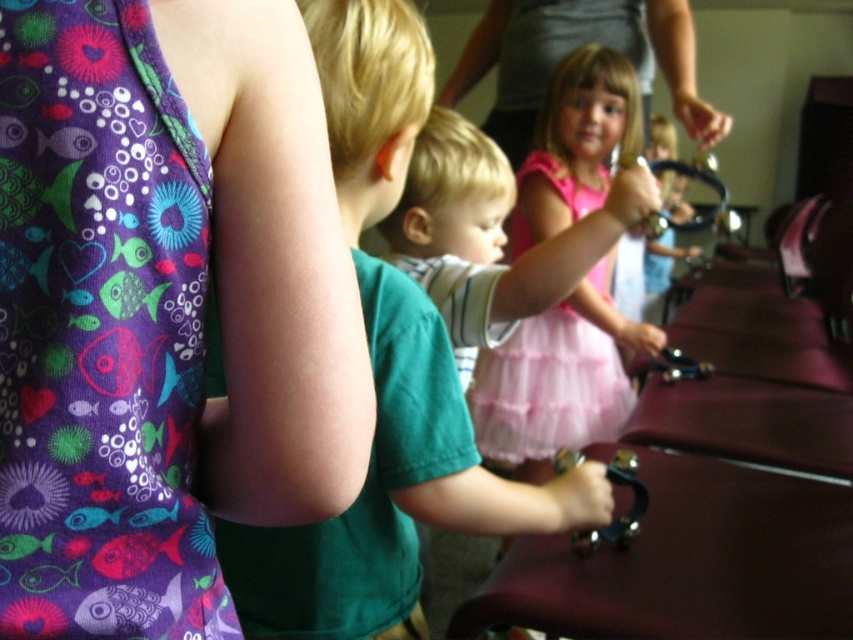
You are a photographer trying to capture a closeup of the child holding the handbell at point (630, 392) while also wanting to include the other child at point (680, 24) in the frame. Which child should you focus on to ensure the subject is sharp and in focus?

You should focus on the child at point (630, 392) because it is closer to the camera and will be in focus, while the other child at point (680, 24) will be slightly out of focus due to the depth of field.

You are a costume designer preparing for a play. You have two options for a character costume. The purple fabric dress at left and the pink tulle skirt at center. If you want to choose the one that takes up more space visually, which should you pick?

The pink tulle skirt at center takes up more visual space than the purple fabric dress at left, so you should choose the pink tulle skirt at center.